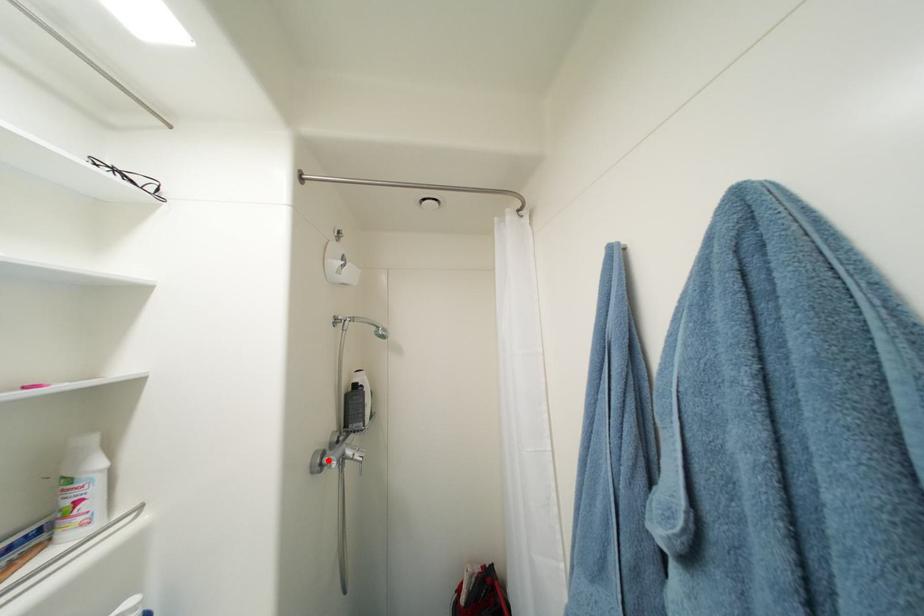
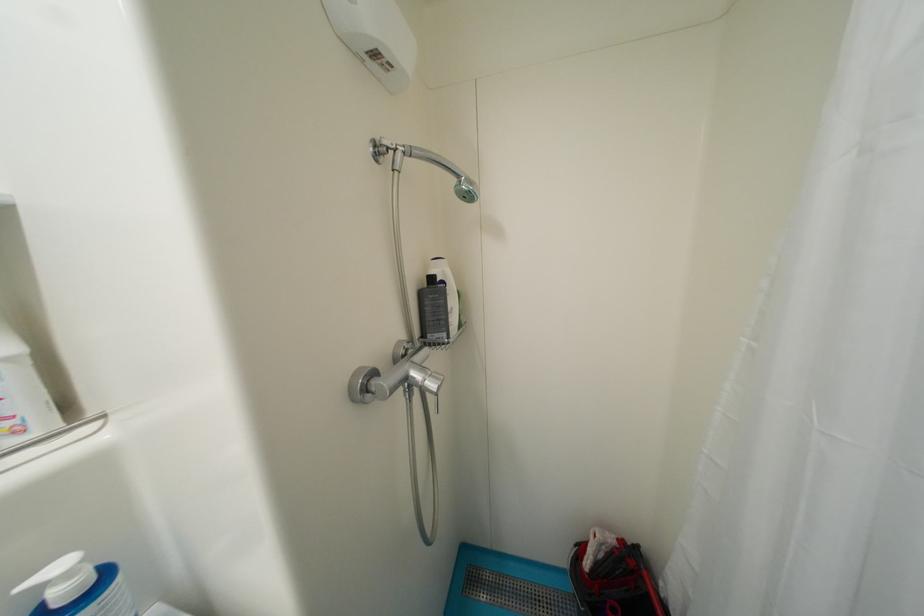
Locate, in the second image, the point that corresponds to the highlighted location in the first image.

(374, 383)